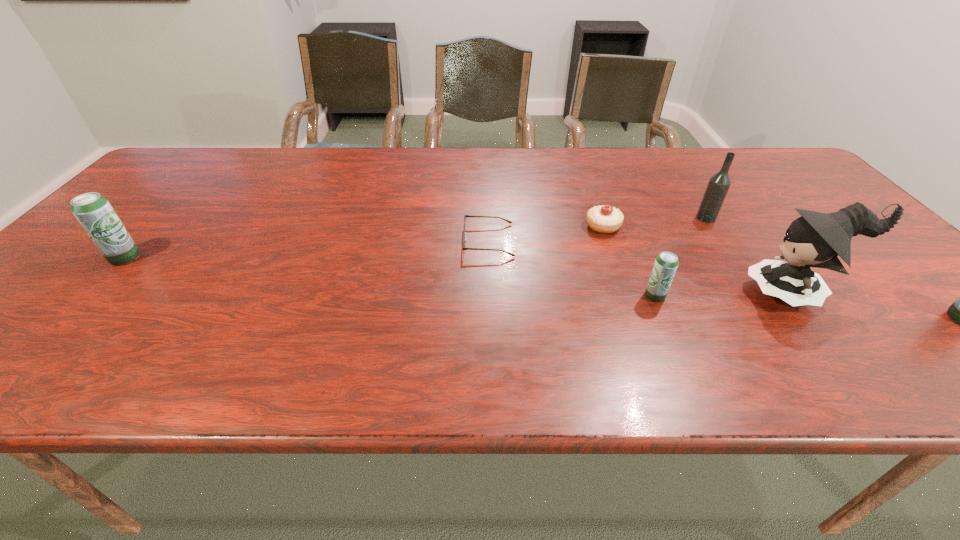
Identify the location of vacant area situated 0.130m on the right of the second farthest beer can. (725, 296).

Where is `free space located on the back of the vodka`? free space located on the back of the vodka is located at coordinates (670, 164).

The height and width of the screenshot is (540, 960). What are the coordinates of `free space located on the back of the second shortest object` in the screenshot? It's located at (591, 193).

The image size is (960, 540). Identify the location of free space located 0.390m on the front-facing side of the shortest object. (309, 240).

Where is `vacant space located 0.170m on the front-facing side of the shortest object`? vacant space located 0.170m on the front-facing side of the shortest object is located at coordinates (396, 240).

Locate an element on the screen. free space located 0.310m on the front-facing side of the shortest object is located at coordinates (341, 240).

Locate an element on the screen. free space located 0.280m at the face of the doll is located at coordinates (619, 293).

Find the location of `vacant space situated at the face of the doll`. vacant space situated at the face of the doll is located at coordinates (669, 293).

At what (x,y) coordinates should I click in order to perform the action: click on blank space located 0.190m at the face of the doll. Please return your answer as a coordinate pair (x, y). The height and width of the screenshot is (540, 960). Looking at the image, I should click on (660, 293).

Image resolution: width=960 pixels, height=540 pixels. Find the location of `object that is at the near edge`. object that is at the near edge is located at coordinates (815, 239).